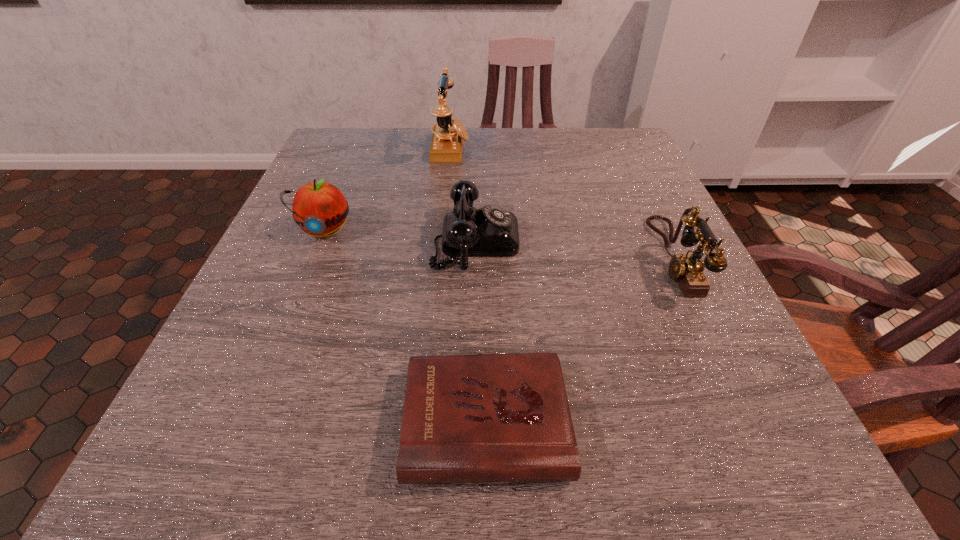
Locate an element on the screen. This screenshot has width=960, height=540. vacant space located 0.270m on the front-facing side of the rightmost object is located at coordinates (x=512, y=258).

I want to click on free location located on the front-facing side of the rightmost object, so click(593, 258).

Find the location of `vacant space located on the right of the apple`. vacant space located on the right of the apple is located at coordinates (503, 230).

Where is `free space located 0.280m on the dial of the second shortest object`? This screenshot has width=960, height=540. free space located 0.280m on the dial of the second shortest object is located at coordinates (663, 240).

At what (x,y) coordinates should I click in order to perform the action: click on blank area located 0.060m on the left of the shortest object. Please return your answer as a coordinate pair (x, y). Image resolution: width=960 pixels, height=540 pixels. Looking at the image, I should click on (359, 422).

Find the location of a particular element. This screenshot has width=960, height=540. object that is at the far edge is located at coordinates (448, 134).

This screenshot has height=540, width=960. I want to click on object that is at the near edge, so click(487, 418).

You are a GUI agent. You are given a task and a screenshot of the screen. Output one action in this format:
    pyautogui.click(x=<x>, y=<y>)
    Task: Click on the object positioned at the left edge
    The width and height of the screenshot is (960, 540).
    Given the screenshot: What is the action you would take?
    pyautogui.click(x=320, y=209)

This screenshot has width=960, height=540. What are the coordinates of `object that is at the right edge` in the screenshot? It's located at (687, 269).

Find the location of a particular element. The height and width of the screenshot is (540, 960). vacant space at the far edge is located at coordinates (407, 156).